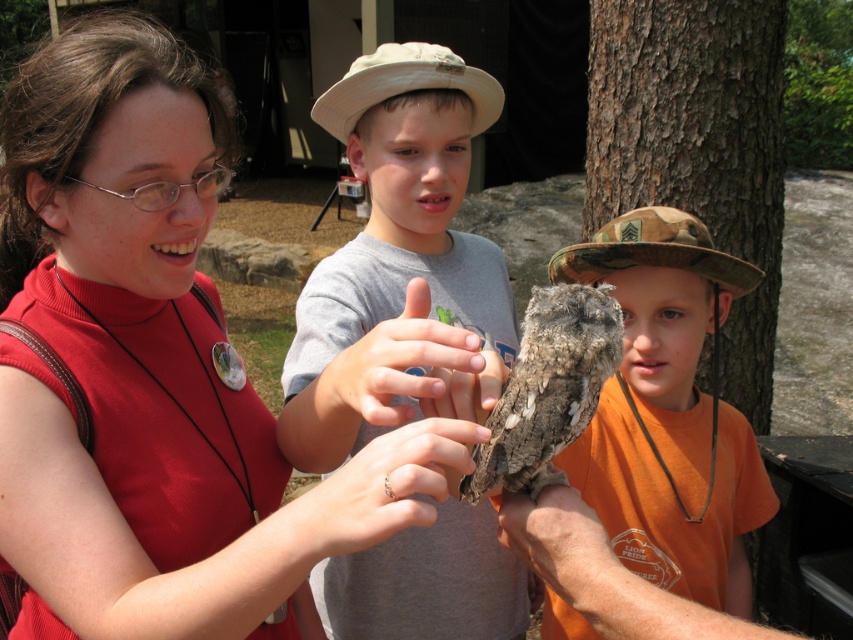
You are a photographer standing at the position of the woman holding the owl. You want to take a photo of both the gray cotton shirt at center and the other boy wearing a dark blue jacket on the right. The camera you are using has a 50cm focal length. Will both subjects be in frame?

The two boys are 69.30 centimeters apart. Since the camera has a 50cm focal length, which typically captures a narrower field of view, the distance between them exceeds the focal length. Therefore, only the gray cotton shirt at center will be in frame, and the other boy might be out of the camera range.

You are standing at the point labeled as point (550, 368) and want to see the owl held by the woman. Is the point labeled point (688, 333) blocking your view of the owl?

Point (688, 333) is behind point (550, 368), so it is not blocking your view of the owl held by the woman.

You are standing at the center of the image and need to place a new object at the same position as the camouflage hat at center. What are the coordinates where you should place the new object?

The camouflage hat at center is located at point (668, 412), so you should place the new object at those coordinates.